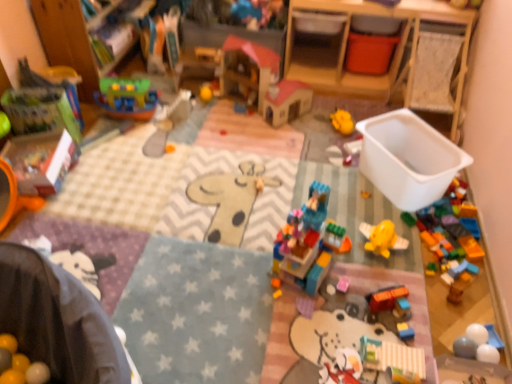
The width and height of the screenshot is (512, 384). What are the coordinates of `free space between translucent plastic airplane at center, which appears as the seventh toy when viewed from the top, and wooden dollhouse at center, which is counted as the 9th toy, starting from the bottom` in the screenshot? It's located at (313, 146).